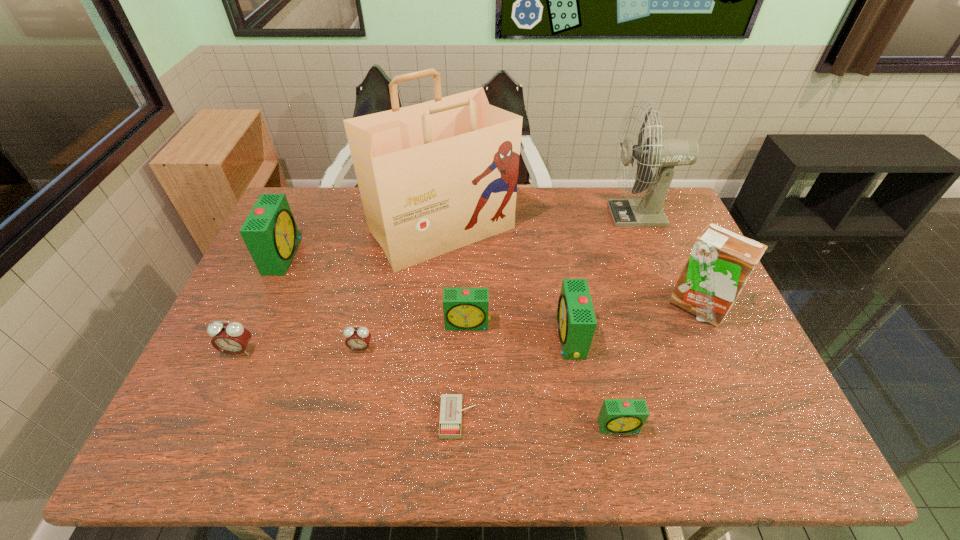
Where is `free space between the fifth shortest alarm clock and the white matchbox`? free space between the fifth shortest alarm clock and the white matchbox is located at coordinates (515, 377).

Where is `unoccupied position between the smallest green alarm clock and the second green alarm clock from left to right`? unoccupied position between the smallest green alarm clock and the second green alarm clock from left to right is located at coordinates (543, 375).

Locate an element on the screen. vacant area that lies between the right pink alarm clock and the third tallest object is located at coordinates (529, 327).

You are a GUI agent. You are given a task and a screenshot of the screen. Output one action in this format:
    pyautogui.click(x=<x>, y=<y>)
    Task: Click on the object that is the fifth closest to the tallest alarm clock
    The width and height of the screenshot is (960, 540).
    Given the screenshot: What is the action you would take?
    pyautogui.click(x=450, y=423)

Identify which object is located as the ninth nearest to the gray fan. Please provide its 2D coordinates. Your answer should be formatted as a tuple, i.e. [(x, y)], where the tuple contains the x and y coordinates of a point satisfying the conditions above.

[(232, 338)]

Locate an element on the screen. alarm clock that is the fifth closest to the matchbox is located at coordinates pos(232,338).

Identify the location of the fifth closest alarm clock relative to the matchbox. The height and width of the screenshot is (540, 960). (232, 338).

Find the location of a particular element. the third closest green alarm clock to the tallest object is located at coordinates (270, 233).

Where is `green alarm clock that can be found as the second closest to the second smallest green alarm clock`? The image size is (960, 540). green alarm clock that can be found as the second closest to the second smallest green alarm clock is located at coordinates (616, 415).